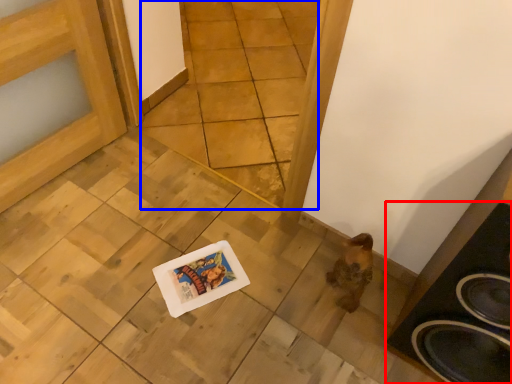
Question: Which of the following is the closest to the observer, speaker (highlighted by a red box) or tile (highlighted by a blue box)?

Choices:
 (A) speaker
 (B) tile

Answer: (A)